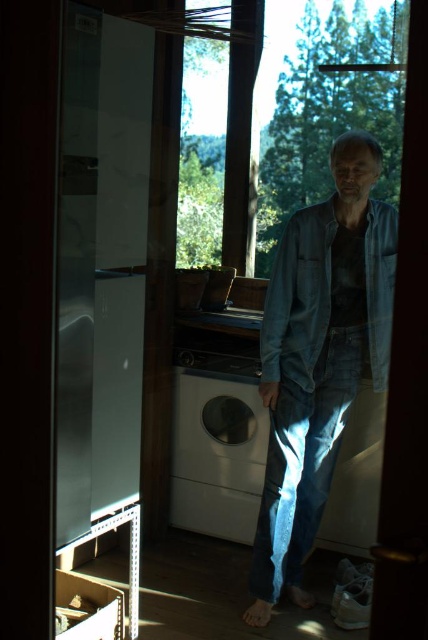
Is denim shirt at center wider than white matte washing machine at center?

Yes, denim shirt at center is wider than white matte washing machine at center.

Can you confirm if denim shirt at center is smaller than white matte washing machine at center?

Incorrect, denim shirt at center is not smaller in size than white matte washing machine at center.

Which is behind, point (288, 301) or point (196, 442)?

The point (196, 442) is more distant.

Identify the location of denim shirt at center. (318, 358).

This screenshot has height=640, width=428. Describe the element at coordinates (318, 358) in the screenshot. I see `denim shirt at center` at that location.

Between point (344, 294) and point (397, 212), which one is positioned behind?

The point (344, 294) is behind.

Locate an element on the screen. Image resolution: width=428 pixels, height=640 pixels. denim shirt at center is located at coordinates (318, 358).

Which is below, white matte washing machine at center or faded denim jacket at lower right?

white matte washing machine at center is below.

What do you see at coordinates (217, 445) in the screenshot? This screenshot has height=640, width=428. I see `white matte washing machine at center` at bounding box center [217, 445].

Which is in front, point (178, 417) or point (288, 305)?

Point (288, 305) is in front.

Locate an element on the screen. This screenshot has height=640, width=428. white matte washing machine at center is located at coordinates (217, 445).